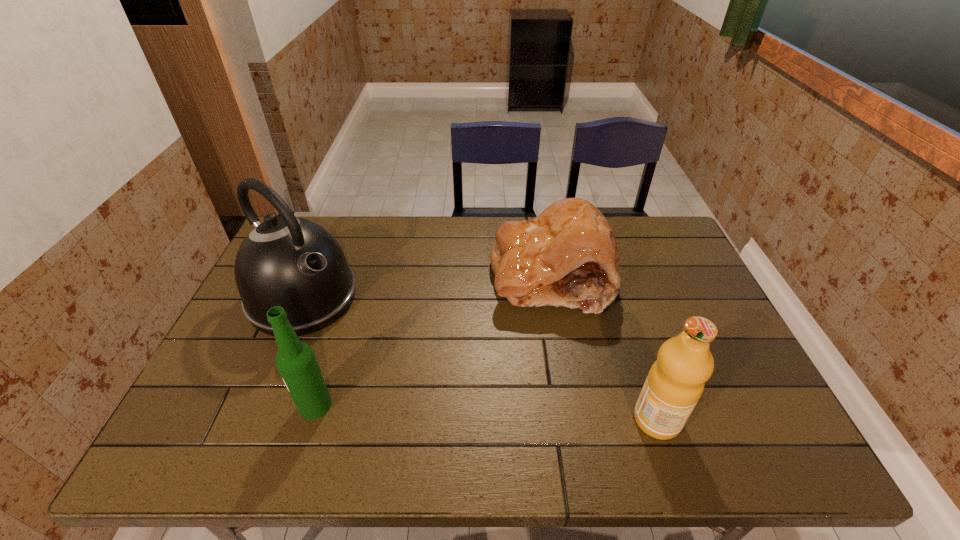
I want to click on free space at the right edge, so click(x=655, y=281).

Identify the location of vacant space at the near right corner of the desktop. The width and height of the screenshot is (960, 540). (751, 400).

Locate an element on the screen. vacant area that lies between the shortest object and the fruit juice is located at coordinates (604, 348).

What are the coordinates of `free space between the fruit juice and the beer bottle` in the screenshot? It's located at (486, 413).

This screenshot has width=960, height=540. I want to click on unoccupied area between the beer bottle and the bread, so click(x=433, y=341).

This screenshot has height=540, width=960. Find the location of `vacant point located between the bread and the tallest object`. vacant point located between the bread and the tallest object is located at coordinates (426, 287).

The width and height of the screenshot is (960, 540). Identify the location of vacant area that lies between the beer bottle and the fruit juice. (486, 413).

This screenshot has height=540, width=960. In order to click on free area in between the bread and the fruit juice in this screenshot , I will do `click(604, 348)`.

Identify the location of vacant region between the shortest object and the fruit juice. Image resolution: width=960 pixels, height=540 pixels. (604, 348).

Where is `unoccupied area between the fruit juice and the kettle`? The height and width of the screenshot is (540, 960). unoccupied area between the fruit juice and the kettle is located at coordinates (480, 359).